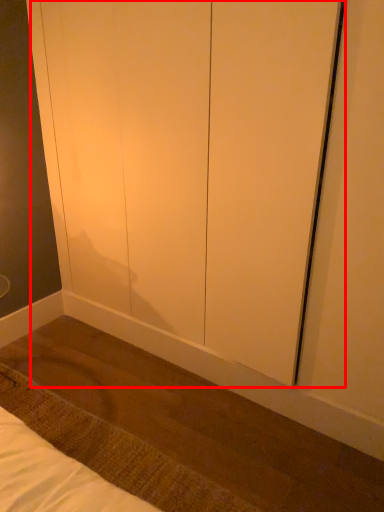
Question: Considering the relative positions of screen door (annotated by the red box) and mat in the image provided, where is screen door (annotated by the red box) located with respect to the staircase?

Choices:
 (A) right
 (B) left

Answer: (A)